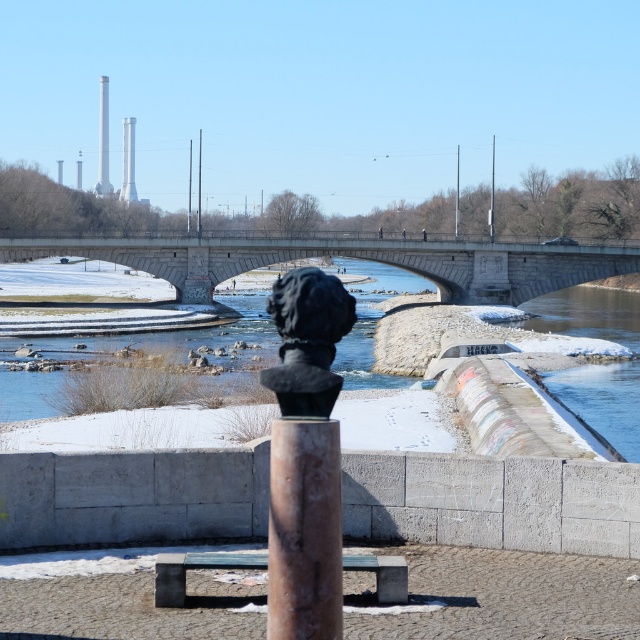
Does stone bridge at center come behind black polished stone bust at center?

That is True.

Does point (323, 244) lie behind point (320, 340)?

Yes, point (323, 244) is behind point (320, 340).

Where is `stone bridge at center`? The image size is (640, 640). stone bridge at center is located at coordinates (352, 257).

Can you confirm if rusty metal pole at center is smaller than smooth concrete pillar at upper center?

Indeed, rusty metal pole at center has a smaller size compared to smooth concrete pillar at upper center.

Which is more to the left, rusty metal pole at center or smooth concrete pillar at upper center?

Positioned to the left is smooth concrete pillar at upper center.

Does point (330, 420) come closer to viewer compared to point (118, 195)?

Yes, point (330, 420) is closer to viewer.

At what (x,y) coordinates should I click in order to perform the action: click on rusty metal pole at center. Please return your answer as a coordinate pair (x, y). Looking at the image, I should click on tap(305, 531).

Does point (317, 604) lie behind point (307, 358)?

No, (317, 604) is in front of (307, 358).

You are a GUI agent. You are given a task and a screenshot of the screen. Output one action in this format:
    pyautogui.click(x=<x>, y=<y>)
    Task: Click on the rusty metal pole at center
    
    Given the screenshot: What is the action you would take?
    pyautogui.click(x=305, y=531)